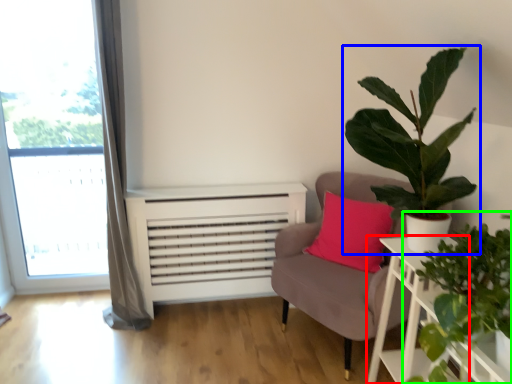
Question: Considering the real-world distances, which object is closest to table (highlighted by a red box)? houseplant (highlighted by a blue box) or houseplant (highlighted by a green box).

Choices:
 (A) houseplant
 (B) houseplant

Answer: (B)